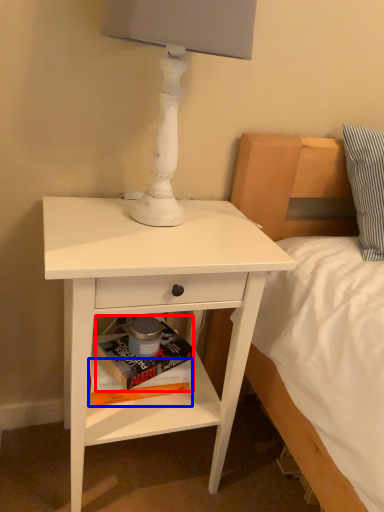
Question: Which of the following is the closest to the observer, paperback book (highlighted by a red box) or paperback book (highlighted by a blue box)?

Choices:
 (A) paperback book
 (B) paperback book

Answer: (A)